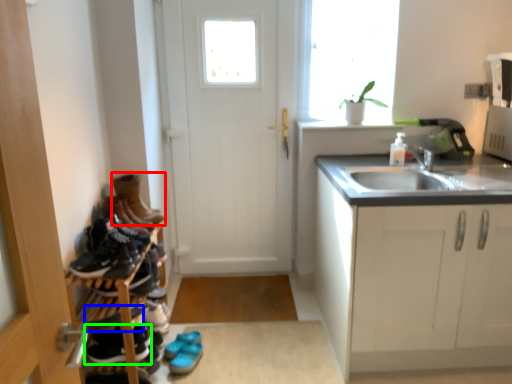
Question: Considering the real-world distances, which object is farthest from footwear (highlighted by a red box)? shoe (highlighted by a blue box) or footwear (highlighted by a green box)?

Choices:
 (A) shoe
 (B) footwear

Answer: (B)